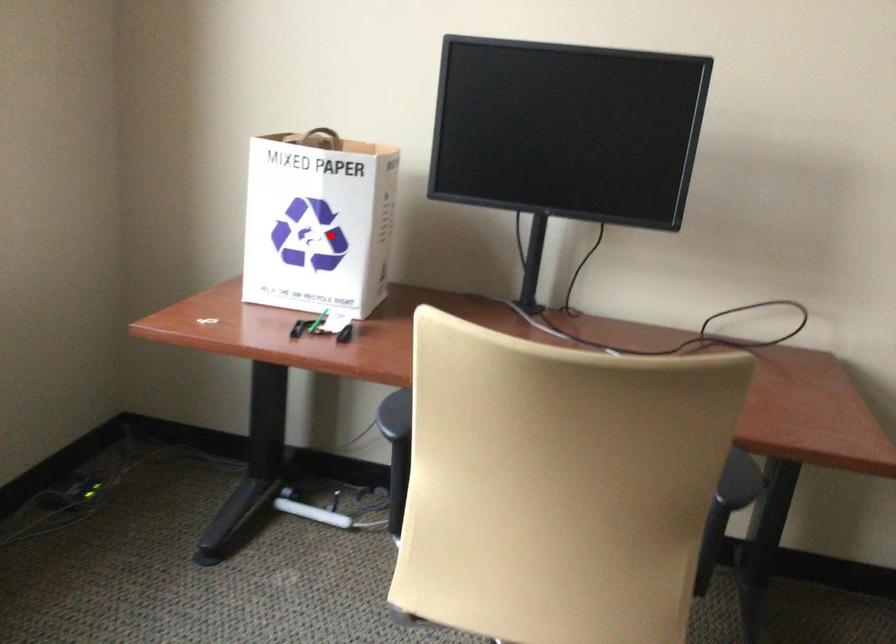
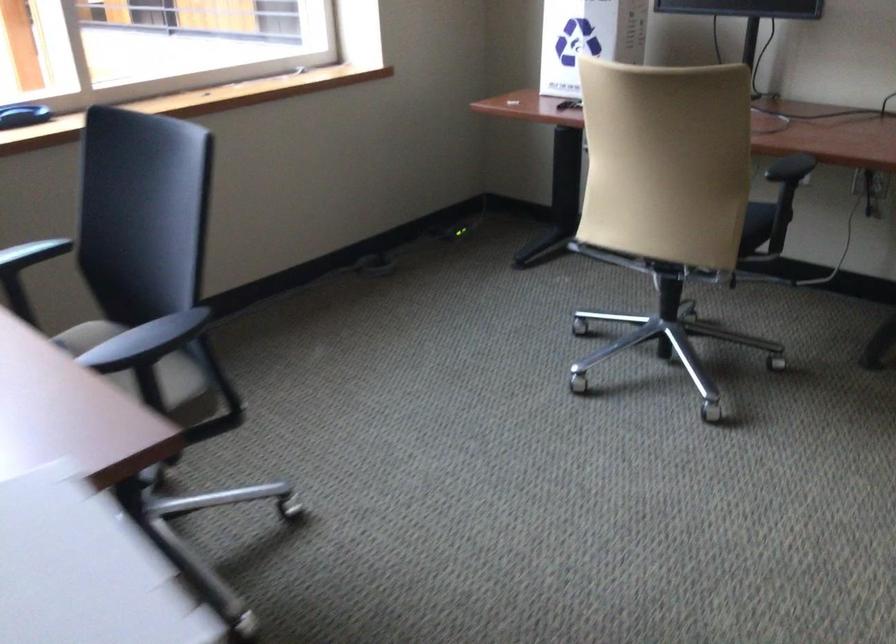
Question: I am providing you with two images of the same scene from different viewpoints. In image1, a red point is highlighted. Considering the same 3D point in image2, which of the following is correct?

Choices:
 (A) It is closer
 (B) It is farther

Answer: (B)